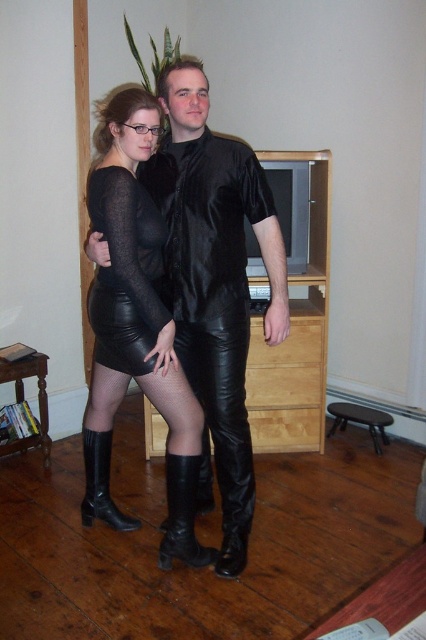
Can you confirm if black leather boot at lower center is positioned to the left of black leather boot at lower left?

Incorrect, black leather boot at lower center is not on the left side of black leather boot at lower left.

You are a GUI agent. You are given a task and a screenshot of the screen. Output one action in this format:
    pyautogui.click(x=<x>, y=<y>)
    Task: Click on the black leather boot at lower center
    The height and width of the screenshot is (640, 426).
    Given the screenshot: What is the action you would take?
    pyautogui.click(x=183, y=515)

Between black leather skirt at center and black leather boot at lower center, which one appears on the right side from the viewer's perspective?

From the viewer's perspective, black leather boot at lower center appears more on the right side.

Can you confirm if black leather skirt at center is thinner than black leather boot at lower center?

No.

Who is more distant from viewer, [196,564] or [184,477]?

The point [196,564] is behind.

Find the location of a particular element. The width and height of the screenshot is (426, 640). black leather skirt at center is located at coordinates pos(135,326).

Which of these two, black leather pants at center or black leather boot at lower left, stands taller?

black leather pants at center is taller.

Is black leather pants at center above black leather boot at lower left?

Yes, black leather pants at center is above black leather boot at lower left.

This screenshot has height=640, width=426. I want to click on black leather pants at center, so click(x=222, y=420).